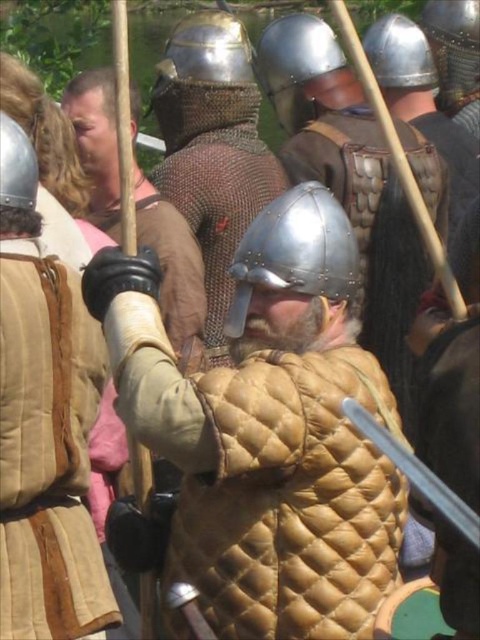
Can you confirm if brown quilted armor at center is positioned to the right of chainmail armor at center?

Incorrect, brown quilted armor at center is not on the right side of chainmail armor at center.

Between brown quilted armor at center and chainmail armor at center, which one appears on the left side from the viewer's perspective?

Positioned to the left is brown quilted armor at center.

Is point (72, 548) farther from camera compared to point (264, 166)?

No.

Where is `brown quilted armor at center`? The height and width of the screenshot is (640, 480). brown quilted armor at center is located at coordinates (48, 452).

Is point (31, 339) less distant than point (301, 230)?

No, it is behind (301, 230).

Between brown quilted armor at center and metallic silver helmet at center, which one has more height?

Standing taller between the two is brown quilted armor at center.

Who is more forward, (61, 500) or (283, 218)?

Point (283, 218) is in front.

In order to click on brown quilted armor at center in this screenshot , I will do `click(48, 452)`.

Consider the image. Is brown quilted armor at center smaller than metallic silver helmet at upper center?

Actually, brown quilted armor at center might be larger than metallic silver helmet at upper center.

Is brown quilted armor at center bigger than metallic silver helmet at upper center?

Yes, brown quilted armor at center is bigger than metallic silver helmet at upper center.

Where is `brown quilted armor at center`? brown quilted armor at center is located at coordinates (48, 452).

This screenshot has height=640, width=480. I want to click on brown quilted armor at center, so (x=48, y=452).